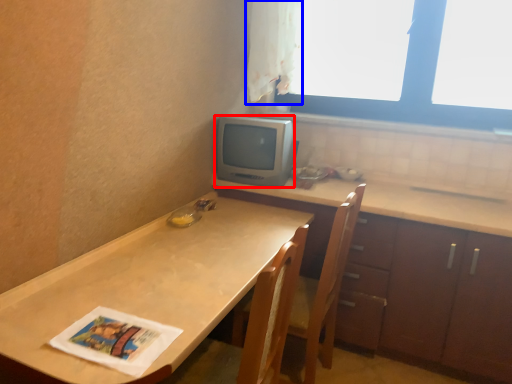
Question: Among these objects, which one is farthest to the camera, appliance (highlighted by a red box) or curtain (highlighted by a blue box)?

Choices:
 (A) appliance
 (B) curtain

Answer: (A)